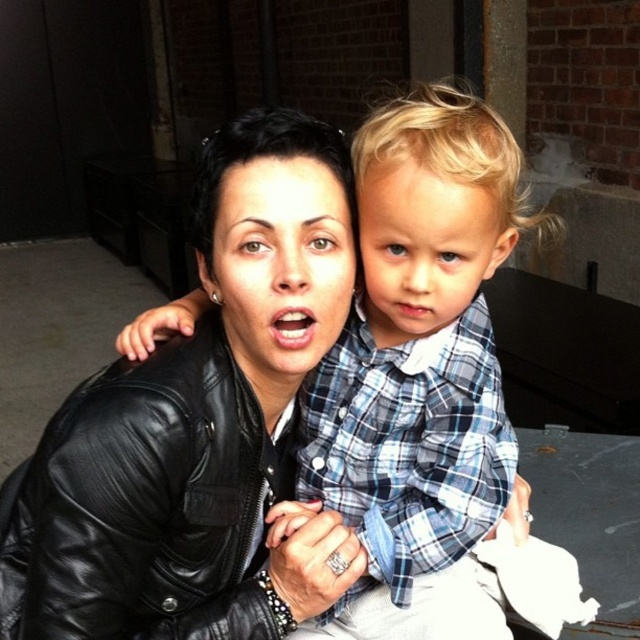
Question: Does blue plaid shirt at center have a smaller size compared to black leather jacket at center?

Choices:
 (A) yes
 (B) no

Answer: (B)

Question: In this image, where is blue plaid shirt at center located relative to black leather jacket at center?

Choices:
 (A) below
 (B) above

Answer: (B)

Question: Which point appears farthest from the camera in this image?

Choices:
 (A) (138, 557)
 (B) (452, 244)

Answer: (A)

Question: Can you confirm if blue plaid shirt at center is bigger than black leather jacket at center?

Choices:
 (A) yes
 (B) no

Answer: (A)

Question: Which object appears closest to the camera in this image?

Choices:
 (A) black leather jacket at center
 (B) blue plaid shirt at center

Answer: (B)

Question: Among these points, which one is nearest to the camera?

Choices:
 (A) (344, 609)
 (B) (84, 404)

Answer: (B)